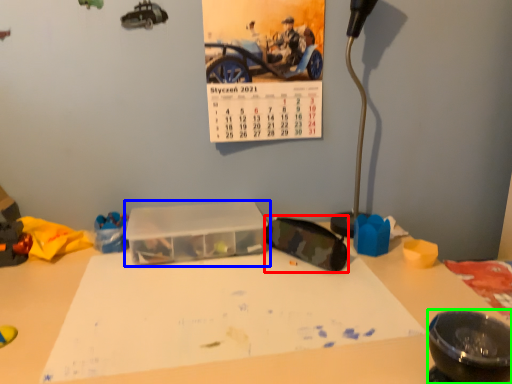
Question: Which object is the farthest from goggles (highlighted by a red box)? Choose among these: glass box (highlighted by a blue box) or bowl (highlighted by a green box).

Choices:
 (A) glass box
 (B) bowl

Answer: (B)